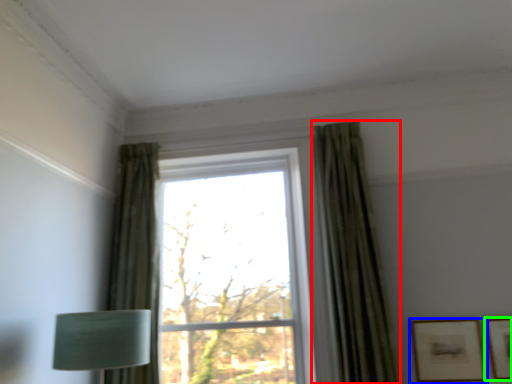
Question: Based on their relative distances, which object is nearer to curtain (highlighted by a red box)? Choose from picture frame (highlighted by a blue box) and picture frame (highlighted by a green box).

Choices:
 (A) picture frame
 (B) picture frame

Answer: (A)